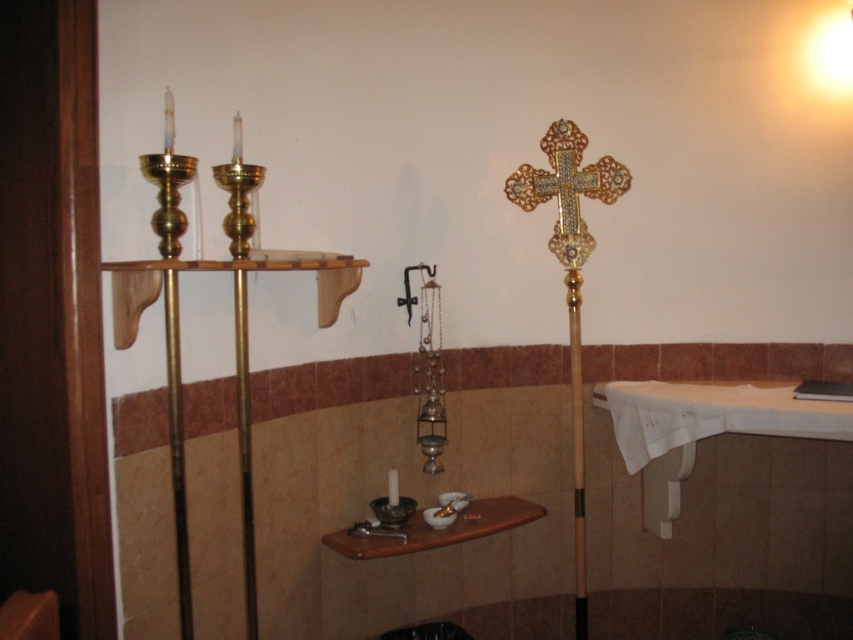
Question: Can you confirm if gold textured cross at right is positioned above gold ornate cross at upper right?

Choices:
 (A) yes
 (B) no

Answer: (B)

Question: Which point is farther to the camera?

Choices:
 (A) gold textured cross at right
 (B) matte black candle holder at center
 (C) gold ornate cross at upper right

Answer: (A)

Question: Is gold textured cross at right smaller than gold ornate cross at upper right?

Choices:
 (A) yes
 (B) no

Answer: (B)

Question: Among these points, which one is nearest to the camera?

Choices:
 (A) (579, 448)
 (B) (529, 193)

Answer: (B)

Question: Which of these objects is positioned farthest from the gold ornate cross at upper right?

Choices:
 (A) gold textured cross at right
 (B) matte black candle holder at center

Answer: (B)

Question: Does gold textured cross at right have a larger size compared to gold ornate cross at upper right?

Choices:
 (A) no
 (B) yes

Answer: (B)